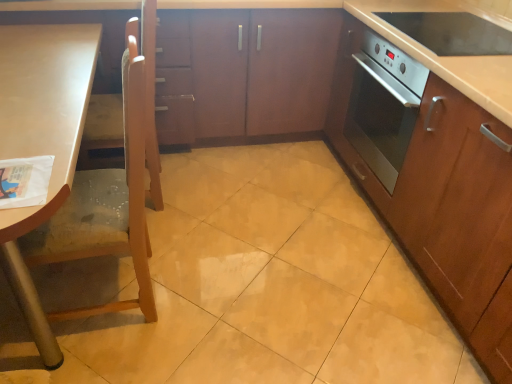
Question: In the image, is light brown wood chair at left positioned in front of or behind metallic oven at right?

Choices:
 (A) front
 (B) behind

Answer: (A)

Question: In terms of width, does light brown wood chair at left look wider or thinner when compared to metallic oven at right?

Choices:
 (A) thin
 (B) wide

Answer: (A)

Question: Which is nearer to the light brown wood chair at left?

Choices:
 (A) satin wood oven at right, which is counted as the second cabinetry, starting from the left
 (B) satin wood countertop at right
 (C) metallic oven at right
 (D) matte wood cabinetry at center, acting as the first cabinetry starting from the left

Answer: (D)

Question: Which object is positioned farthest from the satin wood countertop at right?

Choices:
 (A) satin wood oven at right, which is counted as the second cabinetry, starting from the left
 (B) light brown wood chair at left
 (C) matte wood cabinetry at center, acting as the first cabinetry starting from the left
 (D) metallic oven at right

Answer: (B)